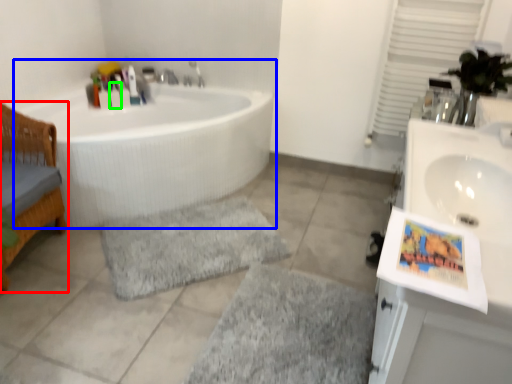
Question: Estimate the real-world distances between objects in this image. Which object is farther from furniture (highlighted by a red box), bathtub (highlighted by a blue box) or toiletry (highlighted by a green box)?

Choices:
 (A) bathtub
 (B) toiletry

Answer: (B)